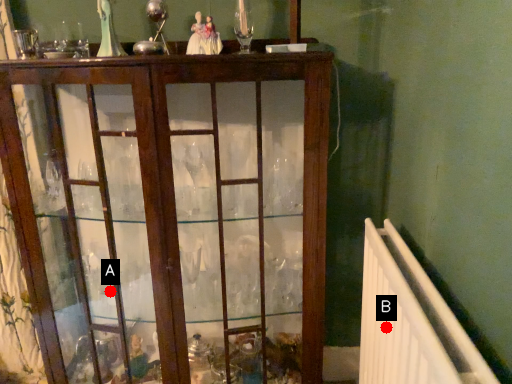
Question: Two points are circled on the image, labeled by A and B beside each circle. Which point is closer to the camera?

Choices:
 (A) A is closer
 (B) B is closer

Answer: (B)